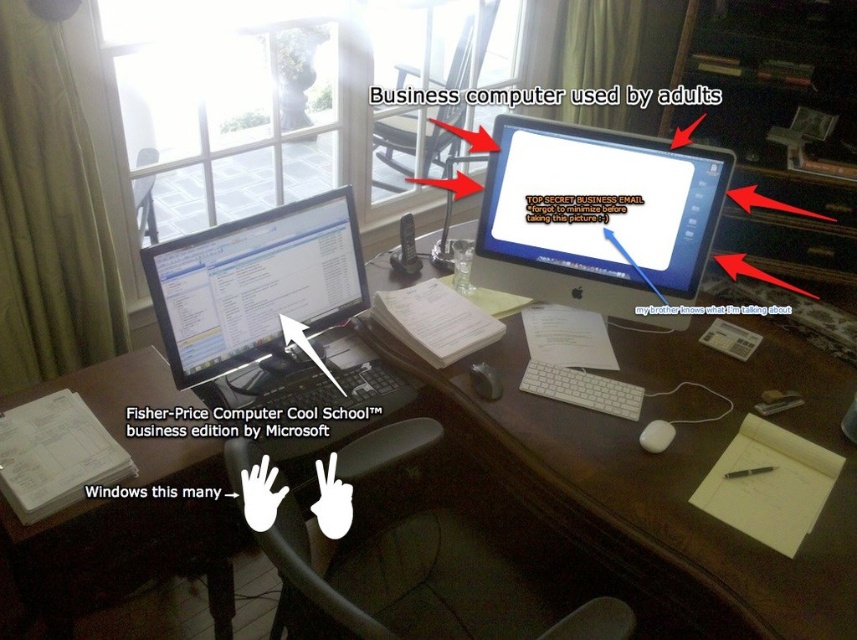
Is matte black monitor at left further to the viewer compared to white matte mouse at center?

No.

Who is positioned more to the left, matte black monitor at left or white matte mouse at center?

Positioned to the left is matte black monitor at left.

In order to click on matte black monitor at left in this screenshot , I will do `click(273, 323)`.

Is white glossy monitor at upper center closer to the viewer compared to white matte mouse at lower right?

No, it is behind white matte mouse at lower right.

Which of these two, white glossy monitor at upper center or white matte mouse at lower right, stands shorter?

With less height is white matte mouse at lower right.

Does point (662, 204) come farther from viewer compared to point (481, 378)?

Yes, point (662, 204) is behind point (481, 378).

Find the location of `white glossy monitor at upper center`. white glossy monitor at upper center is located at coordinates (597, 218).

Who is more forward, (514, 205) or (637, 413)?

Positioned in front is point (637, 413).

Can you confirm if white glossy monitor at upper center is bigger than white plastic keyboard at center?

Indeed, white glossy monitor at upper center has a larger size compared to white plastic keyboard at center.

What do you see at coordinates (597, 218) in the screenshot? The image size is (857, 640). I see `white glossy monitor at upper center` at bounding box center [597, 218].

The width and height of the screenshot is (857, 640). Find the location of `white glossy monitor at upper center`. white glossy monitor at upper center is located at coordinates (597, 218).